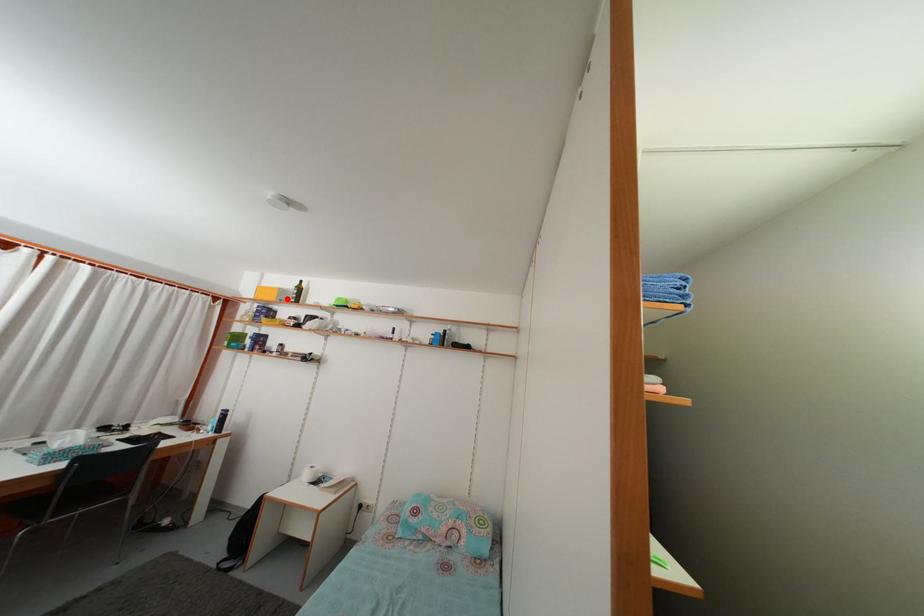
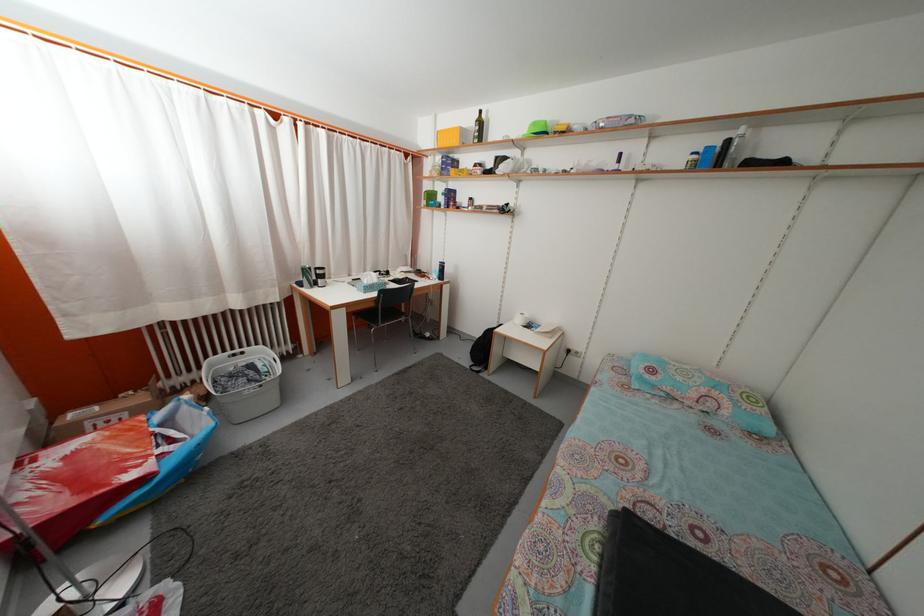
Question: I am providing you with two images of the same scene from different viewpoints. A red point is shown in image1. For the corresponding object point in image2, is it positioned nearer or farther from the camera?

Choices:
 (A) Nearer
 (B) Farther

Answer: (A)